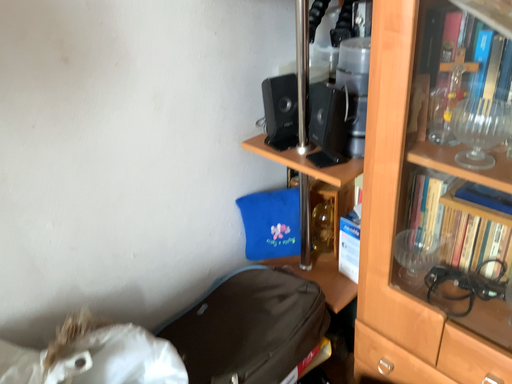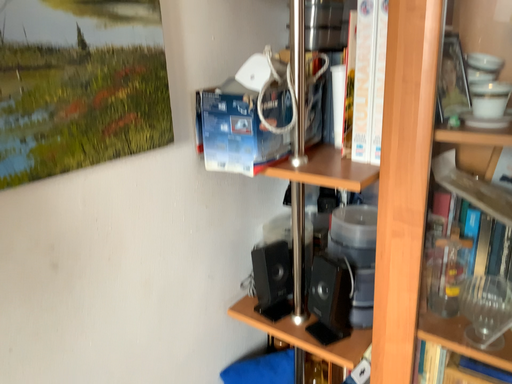
Question: Which way did the camera rotate in the video?

Choices:
 (A) rotated upward
 (B) rotated downward

Answer: (A)